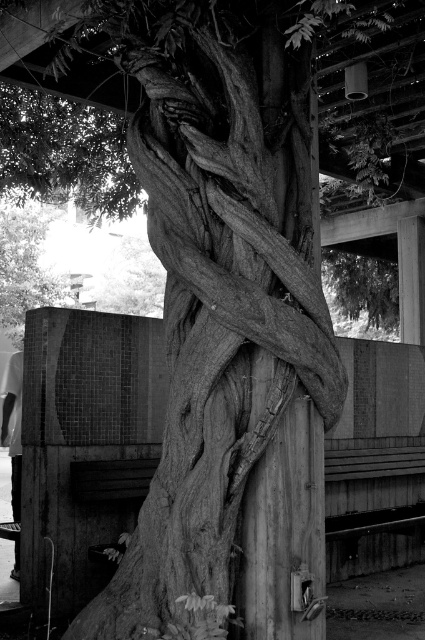
Based on the photo, can you confirm if wooden textured tree trunk at center is wider than wooden textured tree trunk at upper left?

Correct, the width of wooden textured tree trunk at center exceeds that of wooden textured tree trunk at upper left.

Does wooden textured tree trunk at center appear under wooden textured tree trunk at upper left?

Yes, wooden textured tree trunk at center is below wooden textured tree trunk at upper left.

Is point (124, 568) positioned in front of point (22, 321)?

Yes, point (124, 568) is in front of point (22, 321).

Identify the location of wooden textured tree trunk at center. (218, 280).

Is wooden textured tree trunk at upper left thinner than white fabric shirt at lower left?

No, wooden textured tree trunk at upper left is not thinner than white fabric shirt at lower left.

Does wooden textured tree trunk at upper left appear under white fabric shirt at lower left?

Incorrect, wooden textured tree trunk at upper left is not positioned below white fabric shirt at lower left.

Where is `wooden textured tree trunk at upper left`? Image resolution: width=425 pixels, height=640 pixels. wooden textured tree trunk at upper left is located at coordinates (27, 264).

Between wooden textured tree trunk at center and white fabric shirt at lower left, which one has less height?

white fabric shirt at lower left is shorter.

Can you confirm if wooden textured tree trunk at center is bigger than white fabric shirt at lower left?

Indeed, wooden textured tree trunk at center has a larger size compared to white fabric shirt at lower left.

Identify the location of wooden textured tree trunk at center. This screenshot has height=640, width=425. (218, 280).